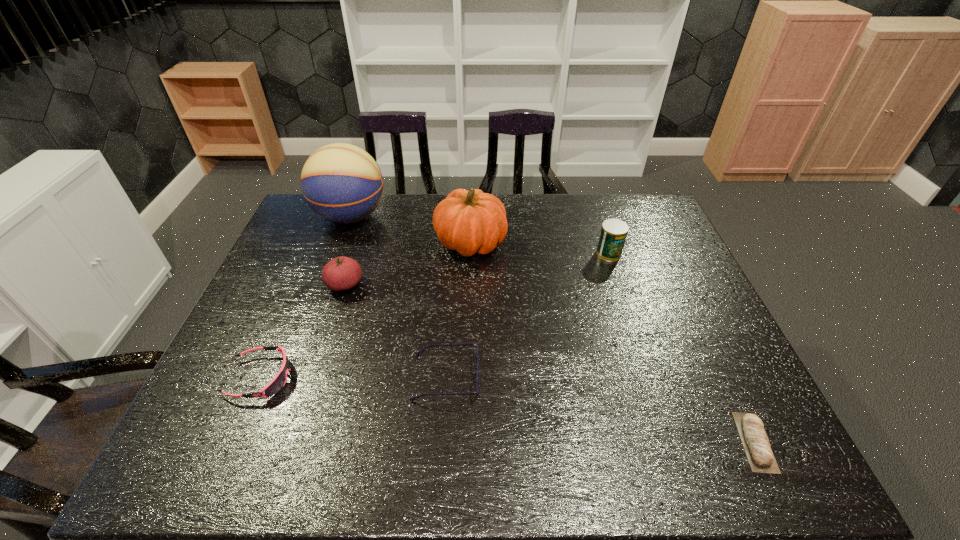
Where is `object that is positioned at the right edge`? The height and width of the screenshot is (540, 960). object that is positioned at the right edge is located at coordinates (756, 444).

Locate an element on the screen. object present at the far left corner is located at coordinates (342, 183).

What are the coordinates of `object that is at the near right corner` in the screenshot? It's located at (756, 444).

The image size is (960, 540). What are the coordinates of `free location at the far edge of the desktop` in the screenshot? It's located at (401, 202).

In the image, there is a desktop. Where is `vacant space at the near edge`? vacant space at the near edge is located at coordinates (521, 466).

Locate an element on the screen. The image size is (960, 540). blank space at the left edge of the desktop is located at coordinates 264,341.

The height and width of the screenshot is (540, 960). What are the coordinates of `vacant space at the right edge` in the screenshot? It's located at (649, 276).

The height and width of the screenshot is (540, 960). In order to click on empty space between the basketball and the goggles in this screenshot , I will do `click(305, 297)`.

Identify the location of free space that is in between the sixth shortest object and the nearest object. This screenshot has width=960, height=540. (612, 342).

In order to click on free space between the basketball and the rightmost object in this screenshot , I will do `click(553, 329)`.